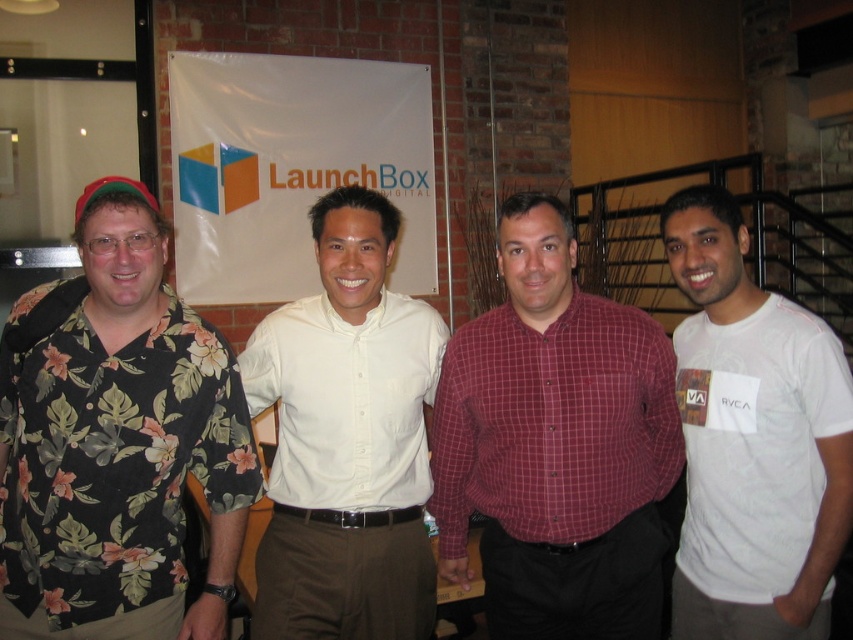
Question: Can you confirm if floral print shirt at left is positioned to the left of white smooth shirt at center?

Choices:
 (A) yes
 (B) no

Answer: (A)

Question: Can you confirm if maroon checkered shirt at center is thinner than white smooth shirt at center?

Choices:
 (A) yes
 (B) no

Answer: (B)

Question: Among these objects, which one is farthest from the camera?

Choices:
 (A) maroon checkered shirt at center
 (B) white smooth shirt at center
 (C) white cotton t-shirt at right
 (D) floral print shirt at left

Answer: (B)

Question: Based on their relative distances, which object is nearer to the white smooth shirt at center?

Choices:
 (A) floral print shirt at left
 (B) maroon checkered shirt at center

Answer: (B)

Question: Can you confirm if floral print shirt at left is thinner than white smooth shirt at center?

Choices:
 (A) yes
 (B) no

Answer: (B)

Question: Estimate the real-world distances between objects in this image. Which object is farther from the maroon checkered shirt at center?

Choices:
 (A) floral print shirt at left
 (B) white cotton t-shirt at right

Answer: (A)